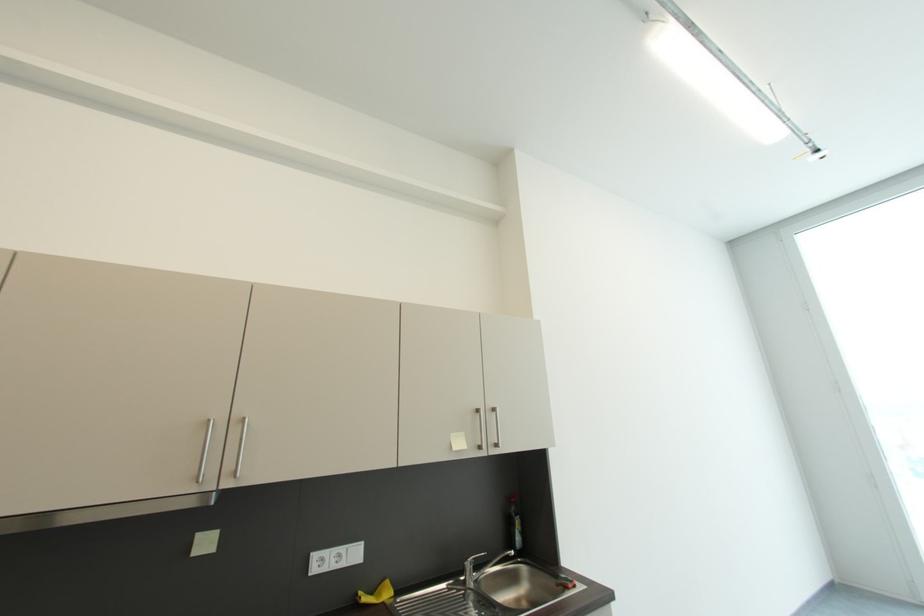
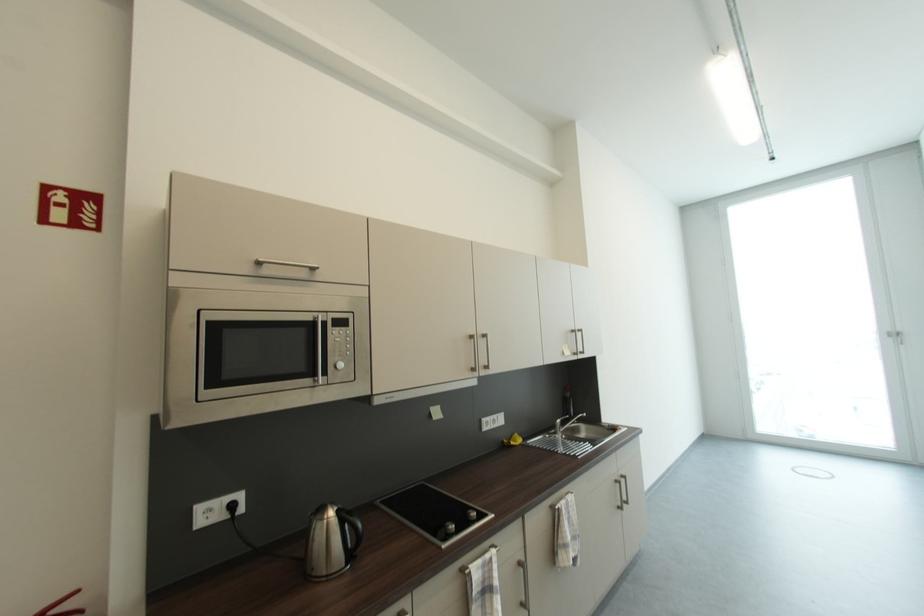
What movement of the cameraman would produce the second image?

The movement direction of the cameraman is left, backward.